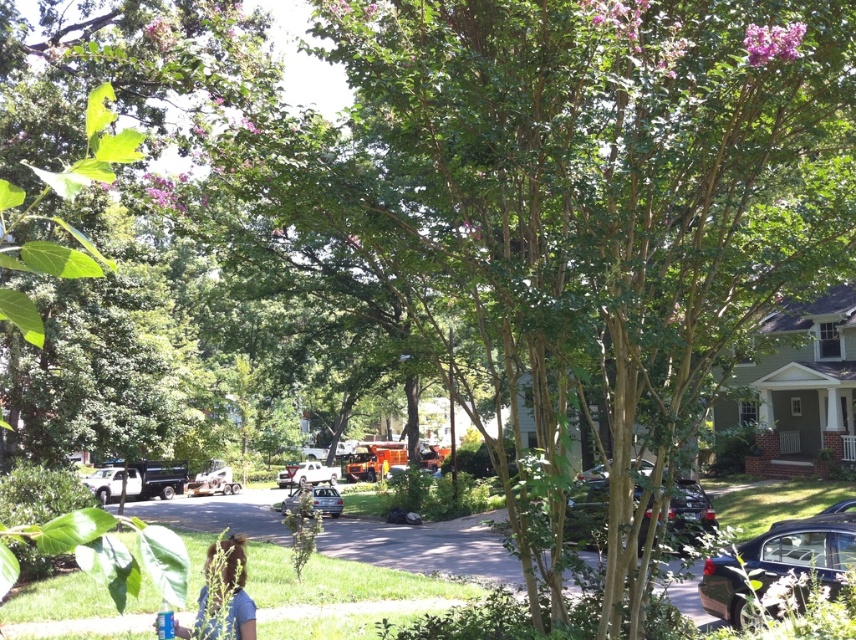
Does shiny black sedan at center appear over metallic silver sedan at center?

Answer: Correct, shiny black sedan at center is located above metallic silver sedan at center.

In the scene shown: Can you confirm if shiny black sedan at center is taller than metallic silver sedan at center?

Yes.

Who is more forward, (580, 502) or (308, 490)?

Point (580, 502) is more forward.

What are the coordinates of `shiny black sedan at center` in the screenshot? It's located at (586, 508).

Can you confirm if shiny dark blue sedan at lower right is thinner than shiny black sedan at center?

Yes.

Between shiny dark blue sedan at lower right and shiny black sedan at center, which one has less height?

Standing shorter between the two is shiny dark blue sedan at lower right.

Is point (817, 540) positioned in front of point (574, 499)?

No, (817, 540) is further to viewer.

Find the location of a particular element. The width and height of the screenshot is (856, 640). shiny dark blue sedan at lower right is located at coordinates (779, 561).

Does point (767, 577) lie behind point (342, 508)?

That is False.

Describe the element at coordinates (779, 561) in the screenshot. I see `shiny dark blue sedan at lower right` at that location.

What are the coordinates of `shiny dark blue sedan at lower right` in the screenshot? It's located at (779, 561).

This screenshot has height=640, width=856. Identify the location of shiny dark blue sedan at lower right. (779, 561).